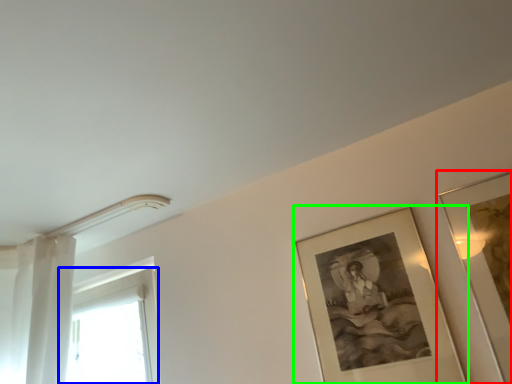
Question: Based on their relative distances, which object is nearer to picture frame (highlighted by a red box)? Choose from window (highlighted by a blue box) and picture frame (highlighted by a green box).

Choices:
 (A) window
 (B) picture frame

Answer: (B)